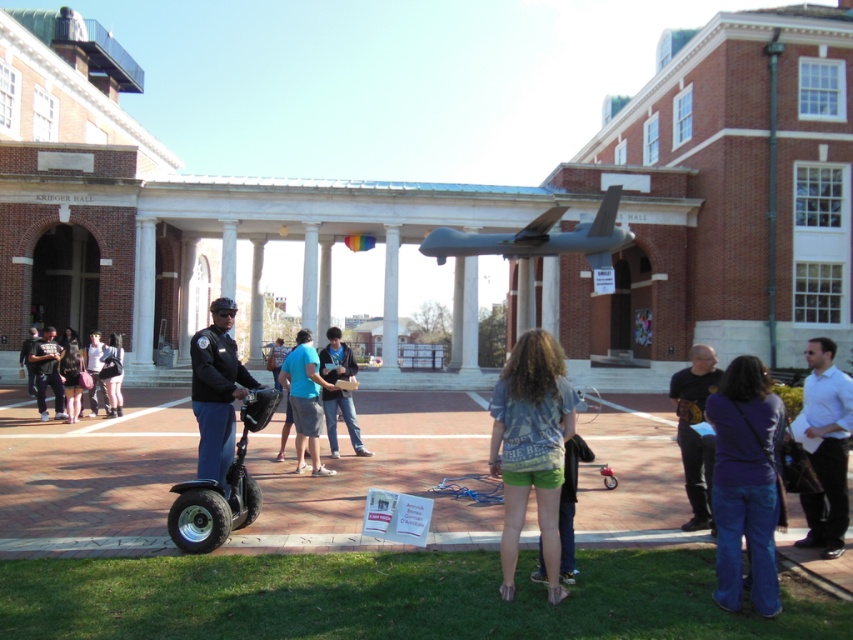
Question: Based on their relative distances, which object is farther from the denim shorts at center?

Choices:
 (A) purple denim jeans at lower right
 (B) blue t-shirt at center
 (C) blue jeans at center

Answer: (C)

Question: Can you confirm if dark gray shirt at center is positioned to the right of dark blue jacket at center?

Choices:
 (A) yes
 (B) no

Answer: (A)

Question: Is white smooth shirt at right to the right of black rubber segway at center from the viewer's perspective?

Choices:
 (A) no
 (B) yes

Answer: (B)

Question: Among these objects, which one is nearest to the camera?

Choices:
 (A) dark blue jeans at lower left
 (B) purple denim jeans at lower right
 (C) dark gray shirt at center

Answer: (B)

Question: Is blue t-shirt at center to the right of blue jeans at center from the viewer's perspective?

Choices:
 (A) yes
 (B) no

Answer: (A)

Question: Estimate the real-world distances between objects in this image. Which object is farther from the denim jacket at lower left?

Choices:
 (A) blue jeans at center
 (B) denim shorts at center

Answer: (B)